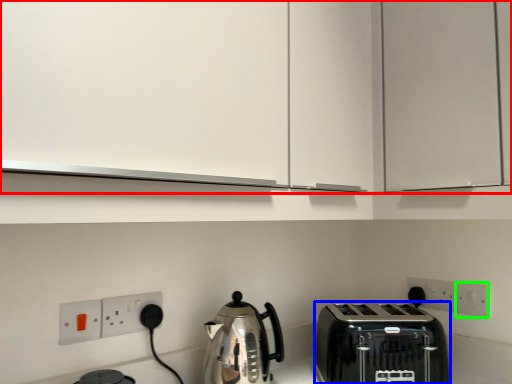
Question: Estimate the real-world distances between objects in this image. Which object is closer to cabinetry (highlighted by a red box), toaster (highlighted by a blue box) or electric outlet (highlighted by a green box)?

Choices:
 (A) toaster
 (B) electric outlet

Answer: (A)